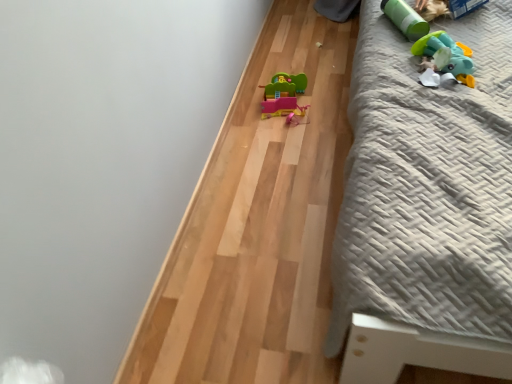
Measure the distance between gray textured bed at right and camera.

gray textured bed at right is 30.24 inches away from camera.

How much space does green matte cylinder at upper right, the second toy in the front-to-back sequence, occupy horizontally?

The width of green matte cylinder at upper right, the second toy in the front-to-back sequence, is 9.52 inches.

Image resolution: width=512 pixels, height=384 pixels. I want to click on matte plastic toy car at center, which is the 1th toy in back-to-front order, so click(283, 95).

Based on the photo, is rubber duck at upper right, the third toy positioned from the left, positioned with its back to gray textured bed at right?

Yes, gray textured bed at right is at the back of rubber duck at upper right, the third toy positioned from the left.

From a real-world perspective, is rubber duck at upper right, which ranks as the 1th toy in right-to-left order, physically located above or below gray textured bed at right?

rubber duck at upper right, which ranks as the 1th toy in right-to-left order, is above gray textured bed at right.

Considering the relative sizes of rubber duck at upper right, which appears as the 3th toy when viewed from the back, and gray textured bed at right in the image provided, is rubber duck at upper right, which appears as the 3th toy when viewed from the back, bigger than gray textured bed at right?

Incorrect, rubber duck at upper right, which appears as the 3th toy when viewed from the back, is not larger than gray textured bed at right.

Is green matte cylinder at upper right, which is counted as the 2th toy, starting from the right, a part of rubber duck at upper right, which is counted as the first toy, starting from the front?

Actually, green matte cylinder at upper right, which is counted as the 2th toy, starting from the right, is outside rubber duck at upper right, which is counted as the first toy, starting from the front.

In the scene shown: Can you tell me how much rubber duck at upper right, which ranks as the 1th toy in right-to-left order, and green matte cylinder at upper right, acting as the second toy starting from the back, differ in facing direction?

The angular difference between rubber duck at upper right, which ranks as the 1th toy in right-to-left order, and green matte cylinder at upper right, acting as the second toy starting from the back, is 17.3 degrees.

Between rubber duck at upper right, which appears as the 3th toy when viewed from the back, and green matte cylinder at upper right, acting as the 2th toy starting from the left, which one has less height?

Standing shorter between the two is rubber duck at upper right, which appears as the 3th toy when viewed from the back.

Which is more to the right, rubber duck at upper right, which ranks as the 1th toy in right-to-left order, or green matte cylinder at upper right, the second toy in the front-to-back sequence?

Positioned to the right is rubber duck at upper right, which ranks as the 1th toy in right-to-left order.

Considering the sizes of matte plastic toy car at center, which appears as the first toy when viewed from the left, and green matte cylinder at upper right, which is counted as the 2th toy, starting from the right, in the image, is matte plastic toy car at center, which appears as the first toy when viewed from the left, taller or shorter than green matte cylinder at upper right, which is counted as the 2th toy, starting from the right,?

In the image, matte plastic toy car at center, which appears as the first toy when viewed from the left, appears to be taller than green matte cylinder at upper right, which is counted as the 2th toy, starting from the right.

From the image's perspective, which one is positioned lower, matte plastic toy car at center, which is the 1th toy in back-to-front order, or green matte cylinder at upper right, the second toy in the front-to-back sequence?

matte plastic toy car at center, which is the 1th toy in back-to-front order, is shown below in the image.

From a real-world perspective, is matte plastic toy car at center, which appears as the first toy when viewed from the left, over green matte cylinder at upper right, acting as the 2th toy starting from the left?

Incorrect, from a real-world perspective, matte plastic toy car at center, which appears as the first toy when viewed from the left, is lower than green matte cylinder at upper right, acting as the 2th toy starting from the left.

Choose the correct answer: Is matte plastic toy car at center, arranged as the third toy when viewed from the right, inside green matte cylinder at upper right, the second toy in the front-to-back sequence, or outside it?

matte plastic toy car at center, arranged as the third toy when viewed from the right, is located beyond the bounds of green matte cylinder at upper right, the second toy in the front-to-back sequence.

Between green matte cylinder at upper right, acting as the 2th toy starting from the left, and matte plastic toy car at center, which is the 1th toy in back-to-front order, which one has more height?

matte plastic toy car at center, which is the 1th toy in back-to-front order.

From the image's perspective, which one is positioned higher, green matte cylinder at upper right, the second toy in the front-to-back sequence, or matte plastic toy car at center, which appears as the first toy when viewed from the left?

green matte cylinder at upper right, the second toy in the front-to-back sequence, appears higher in the image.

From a real-world perspective, which object rests below the other?

From a 3D spatial view, matte plastic toy car at center, which appears as the first toy when viewed from the left, is below.

What's the angular difference between green matte cylinder at upper right, acting as the second toy starting from the back, and matte plastic toy car at center, the third toy from the front,'s facing directions?

63.5 degrees.

How much distance is there between matte plastic toy car at center, the third toy from the front, and gray textured bed at right?

A distance of 68.14 centimeters exists between matte plastic toy car at center, the third toy from the front, and gray textured bed at right.

Is matte plastic toy car at center, the third toy from the front, wider than gray textured bed at right?

No.

Who is shorter, matte plastic toy car at center, which appears as the first toy when viewed from the left, or gray textured bed at right?

With less height is matte plastic toy car at center, which appears as the first toy when viewed from the left.

Is matte plastic toy car at center, which is the 1th toy in back-to-front order, facing away from gray textured bed at right?

No, matte plastic toy car at center, which is the 1th toy in back-to-front order, is not facing away from gray textured bed at right.

Between gray textured bed at right and matte plastic toy car at center, the third toy from the front, which one is positioned behind?

matte plastic toy car at center, the third toy from the front, is further from the camera.

Based on the photo, could you measure the distance between gray textured bed at right and matte plastic toy car at center, arranged as the third toy when viewed from the right?

The distance of gray textured bed at right from matte plastic toy car at center, arranged as the third toy when viewed from the right, is 26.83 inches.

Between gray textured bed at right and matte plastic toy car at center, the third toy from the front, which one appears on the right side from the viewer's perspective?

gray textured bed at right.

Where is `toy that is the 3rd object located behind the gray textured bed at right`? This screenshot has width=512, height=384. toy that is the 3rd object located behind the gray textured bed at right is located at coordinates (283, 95).

From the image's perspective, count 1st toys upward from the matte plastic toy car at center, the third toy from the front, and point to it. Please provide its 2D coordinates.

[(445, 56)]

Is rubber duck at upper right, which appears as the 3th toy when viewed from the back, smaller than matte plastic toy car at center, the third toy from the front?

Correct, rubber duck at upper right, which appears as the 3th toy when viewed from the back, occupies less space than matte plastic toy car at center, the third toy from the front.

From the image's perspective, is rubber duck at upper right, which is counted as the first toy, starting from the front, located above or below matte plastic toy car at center, which is the 1th toy in back-to-front order?

rubber duck at upper right, which is counted as the first toy, starting from the front, is situated higher than matte plastic toy car at center, which is the 1th toy in back-to-front order, in the image.

Is rubber duck at upper right, which is counted as the first toy, starting from the front, far away from matte plastic toy car at center, which appears as the first toy when viewed from the left?

They are positioned close to each other.

At what (x,y) coordinates should I click in order to perform the action: click on furniture beneath the rubber duck at upper right, the third toy positioned from the left (from a real-world perspective). Please return your answer as a coordinate pair (x, y). This screenshot has height=384, width=512. Looking at the image, I should click on (426, 185).

Locate an element on the screen. The width and height of the screenshot is (512, 384). the 1st toy positioned below the green matte cylinder at upper right, acting as the 2th toy starting from the left (from the image's perspective) is located at coordinates (445, 56).

From the image, which object appears to be nearer to gray textured bed at right, rubber duck at upper right, which ranks as the 1th toy in right-to-left order, or matte plastic toy car at center, arranged as the third toy when viewed from the right?

Based on the image, rubber duck at upper right, which ranks as the 1th toy in right-to-left order, appears to be nearer to gray textured bed at right.

Based on their spatial positions, is rubber duck at upper right, the third toy positioned from the left, or matte plastic toy car at center, which appears as the first toy when viewed from the left, further from green matte cylinder at upper right, acting as the second toy starting from the back?

Among the two, matte plastic toy car at center, which appears as the first toy when viewed from the left, is located further to green matte cylinder at upper right, acting as the second toy starting from the back.

Considering their positions, is green matte cylinder at upper right, acting as the 2th toy starting from the left, positioned closer to rubber duck at upper right, the third toy positioned from the left, than gray textured bed at right?

Based on the image, green matte cylinder at upper right, acting as the 2th toy starting from the left, appears to be nearer to rubber duck at upper right, the third toy positioned from the left.

Looking at the image, which one is located further to green matte cylinder at upper right, which is counted as the 2th toy, starting from the right, gray textured bed at right or rubber duck at upper right, which ranks as the 1th toy in right-to-left order?

Among the two, gray textured bed at right is located further to green matte cylinder at upper right, which is counted as the 2th toy, starting from the right.

From the image, which object appears to be nearer to rubber duck at upper right, the third toy positioned from the left, green matte cylinder at upper right, which is counted as the 2th toy, starting from the right, or matte plastic toy car at center, arranged as the third toy when viewed from the right?

green matte cylinder at upper right, which is counted as the 2th toy, starting from the right, is positioned closer to the anchor rubber duck at upper right, the third toy positioned from the left.

Based on the photo, considering their positions, is gray textured bed at right positioned closer to matte plastic toy car at center, which is the 1th toy in back-to-front order, than green matte cylinder at upper right, the second toy in the front-to-back sequence?

green matte cylinder at upper right, the second toy in the front-to-back sequence, lies closer to matte plastic toy car at center, which is the 1th toy in back-to-front order, than the other object.

Considering their positions, is matte plastic toy car at center, the third toy from the front, positioned closer to gray textured bed at right than rubber duck at upper right, which ranks as the 1th toy in right-to-left order?

Based on the image, rubber duck at upper right, which ranks as the 1th toy in right-to-left order, appears to be nearer to gray textured bed at right.

Estimate the real-world distances between objects in this image. Which object is further from rubber duck at upper right, which ranks as the 1th toy in right-to-left order, gray textured bed at right or matte plastic toy car at center, the third toy from the front?

Based on the image, matte plastic toy car at center, the third toy from the front, appears to be further to rubber duck at upper right, which ranks as the 1th toy in right-to-left order.

The height and width of the screenshot is (384, 512). Identify the location of toy located between gray textured bed at right and green matte cylinder at upper right, which is counted as the 2th toy, starting from the right, in the depth direction. (445, 56).

This screenshot has width=512, height=384. I want to click on toy between matte plastic toy car at center, the third toy from the front, and rubber duck at upper right, which appears as the 3th toy when viewed from the back, so click(x=405, y=19).